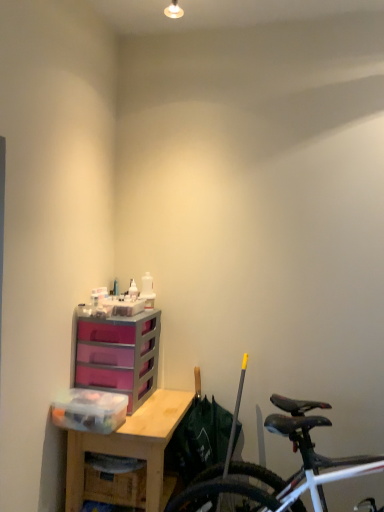
Question: Is transparent plastic storage box at left at the right side of wooden desk at center?

Choices:
 (A) no
 (B) yes

Answer: (A)

Question: Does transparent plastic storage box at left have a greater height compared to wooden desk at center?

Choices:
 (A) no
 (B) yes

Answer: (A)

Question: Does transparent plastic storage box at left have a greater width compared to wooden desk at center?

Choices:
 (A) no
 (B) yes

Answer: (A)

Question: Is transparent plastic storage box at left closer to the viewer compared to wooden desk at center?

Choices:
 (A) no
 (B) yes

Answer: (A)

Question: Can you see transparent plastic storage box at left touching wooden desk at center?

Choices:
 (A) yes
 (B) no

Answer: (B)

Question: From the image's perspective, is transparent plastic storage box at left below wooden desk at center?

Choices:
 (A) yes
 (B) no

Answer: (B)

Question: Considering the relative positions of wooden desk at center and shiny black bicycle at lower right in the image provided, is wooden desk at center behind shiny black bicycle at lower right?

Choices:
 (A) yes
 (B) no

Answer: (A)

Question: Is wooden desk at center closer to the viewer compared to shiny black bicycle at lower right?

Choices:
 (A) yes
 (B) no

Answer: (B)

Question: Does wooden desk at center have a lesser height compared to shiny black bicycle at lower right?

Choices:
 (A) yes
 (B) no

Answer: (A)

Question: From a real-world perspective, is wooden desk at center positioned under shiny black bicycle at lower right based on gravity?

Choices:
 (A) no
 (B) yes

Answer: (B)

Question: Is wooden desk at center surrounding shiny black bicycle at lower right?

Choices:
 (A) yes
 (B) no

Answer: (B)

Question: Is wooden desk at center aimed at shiny black bicycle at lower right?

Choices:
 (A) no
 (B) yes

Answer: (A)

Question: Is there a large distance between transparent plastic storage box at left and purple plastic chest of drawers at center?

Choices:
 (A) yes
 (B) no

Answer: (B)